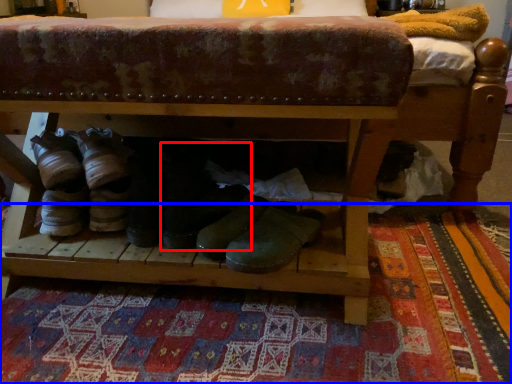
Question: Which object appears closest to the camera in this image, footwear (highlighted by a red box) or mat (highlighted by a blue box)?

Choices:
 (A) footwear
 (B) mat

Answer: (B)